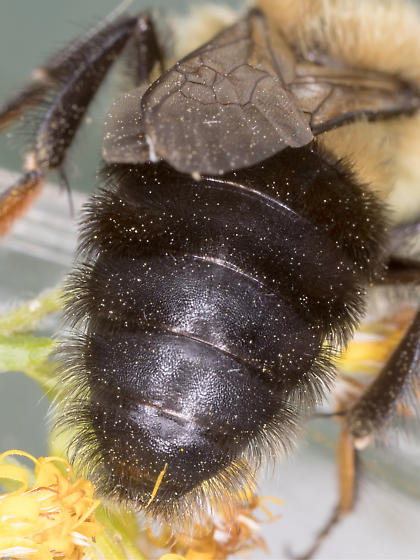
Where is `center leg`? This screenshot has height=560, width=420. center leg is located at coordinates (69, 100).